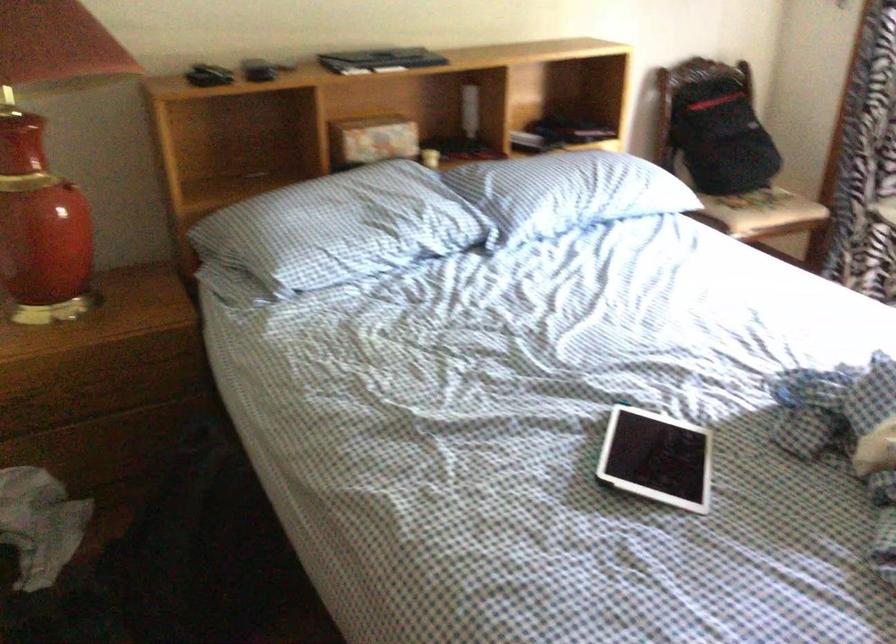
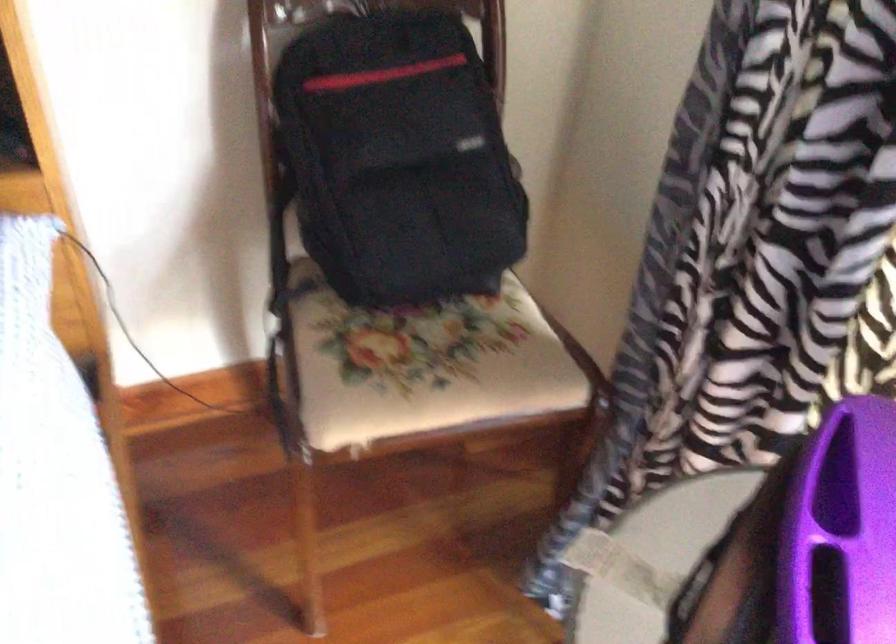
What movement of the cameraman would produce the second image?

The movement direction of the cameraman is right, forward.